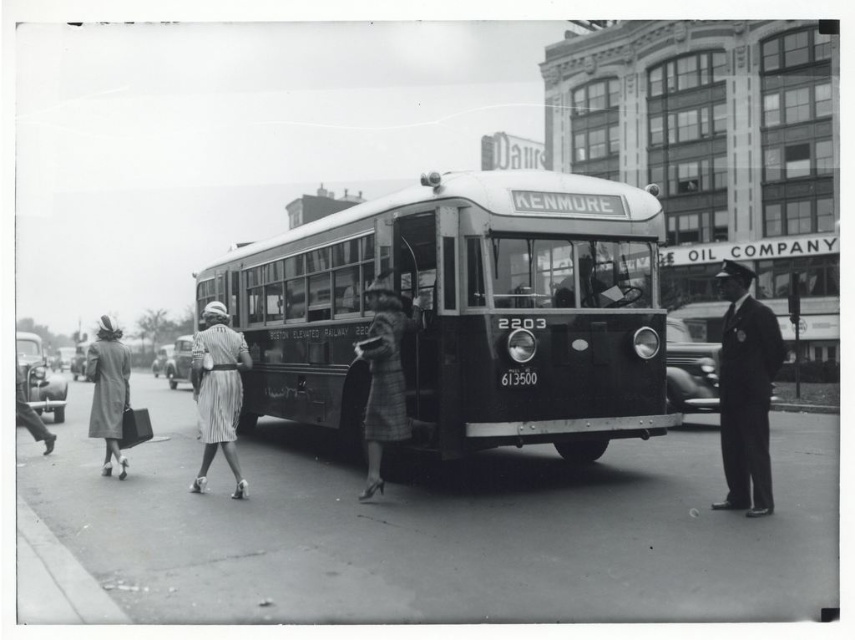
Who is shorter, dark uniform at right or matte gray coat at left?

Standing shorter between the two is matte gray coat at left.

Can you confirm if dark uniform at right is positioned to the left of matte gray coat at left?

No, dark uniform at right is not to the left of matte gray coat at left.

Find the location of a particular element. The image size is (855, 640). dark uniform at right is located at coordinates (746, 392).

Find the location of a particular element. This screenshot has width=855, height=640. dark uniform at right is located at coordinates (746, 392).

Does metallic silver bus at center have a larger size compared to striped fabric dress at center?

Yes, metallic silver bus at center is bigger than striped fabric dress at center.

Can you confirm if metallic silver bus at center is wider than striped fabric dress at center?

Indeed, metallic silver bus at center has a greater width compared to striped fabric dress at center.

The height and width of the screenshot is (640, 855). In order to click on metallic silver bus at center in this screenshot , I will do `click(464, 312)`.

Who is lower down, dark uniform at right or striped fabric dress at center?

striped fabric dress at center is below.

Between point (750, 412) and point (237, 420), which one is positioned behind?

The point (237, 420) is more distant.

Measure the distance between dark uniform at right and camera.

A distance of 6.83 meters exists between dark uniform at right and camera.

Image resolution: width=855 pixels, height=640 pixels. Identify the location of dark uniform at right. (746, 392).